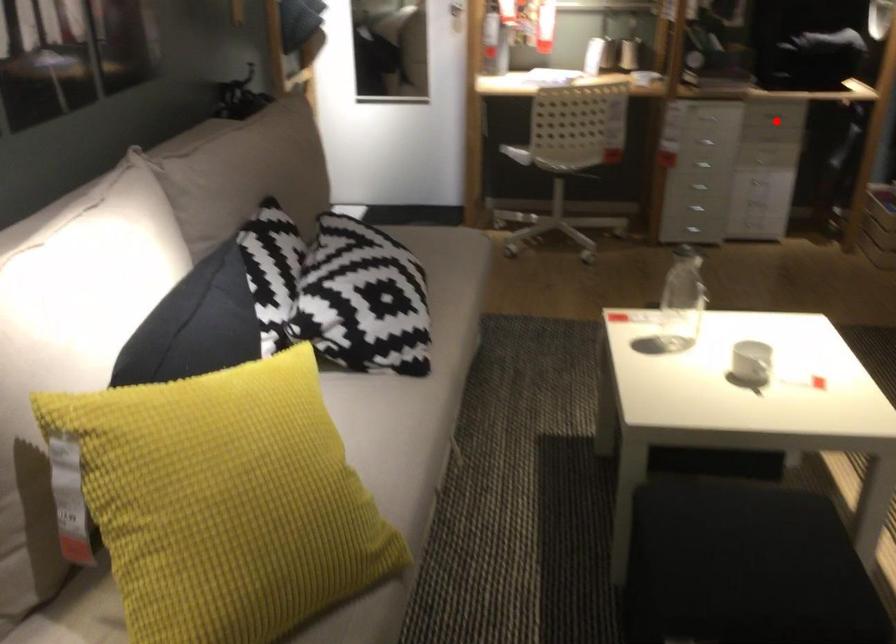
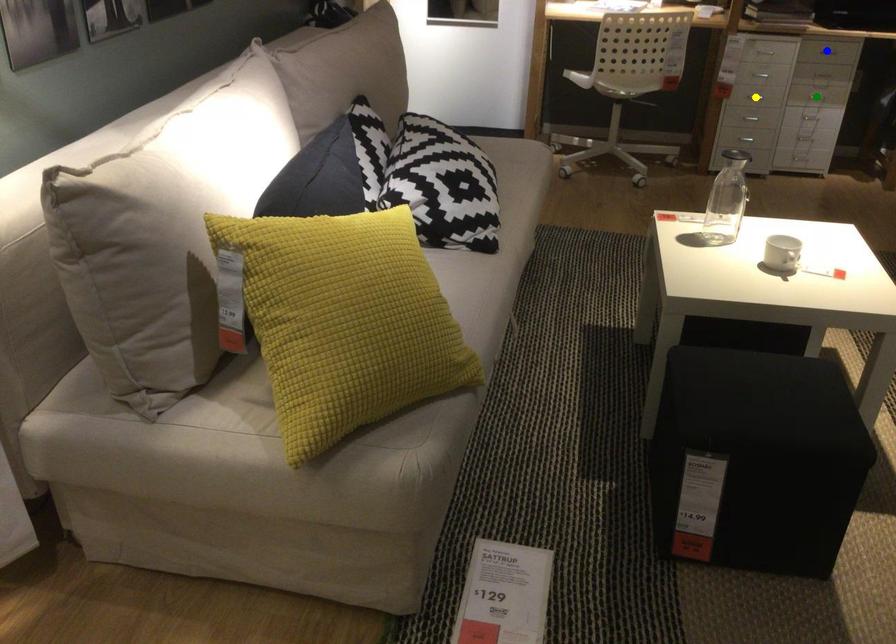
Question: I am providing you with two images of the same scene from different viewpoints. A red point is marked on the first image. You are given multiple points on the second image. Can you choose the point in image 2 that corresponds to the point in image 1?

Choices:
 (A) blue point
 (B) green point
 (C) yellow point

Answer: (A)